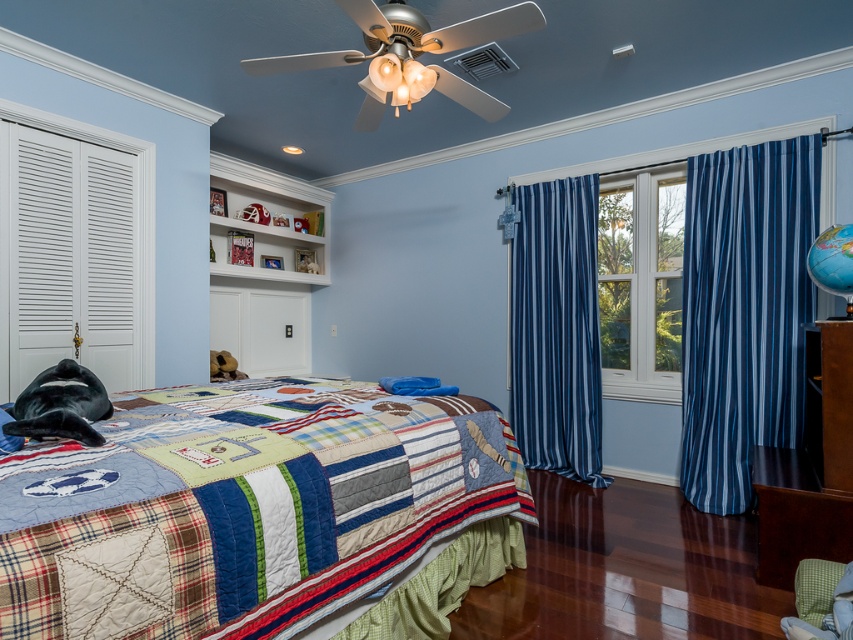
Question: Which of the following is the farthest from the observer?

Choices:
 (A) (560, 212)
 (B) (134, 284)
 (C) (218, 593)

Answer: (A)

Question: Which object is positioned farthest from the blue striped curtain at center?

Choices:
 (A) dark brown wood dresser at lower right
 (B) patchwork quilt at center

Answer: (B)

Question: Is blue striped curtain at right above white wood window at center?

Choices:
 (A) yes
 (B) no

Answer: (B)

Question: Observing the image, what is the correct spatial positioning of blue striped curtain at right in reference to blue striped curtain at center?

Choices:
 (A) above
 (B) below

Answer: (A)

Question: Which point appears closest to the camera in this image?

Choices:
 (A) (830, 332)
 (B) (767, 184)

Answer: (A)

Question: Can you confirm if blue striped curtain at right is wider than white louvered closet door at left?

Choices:
 (A) yes
 (B) no

Answer: (A)